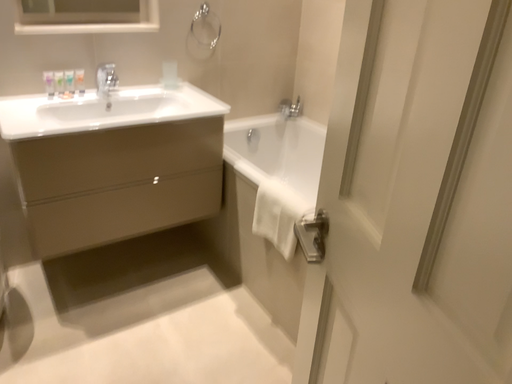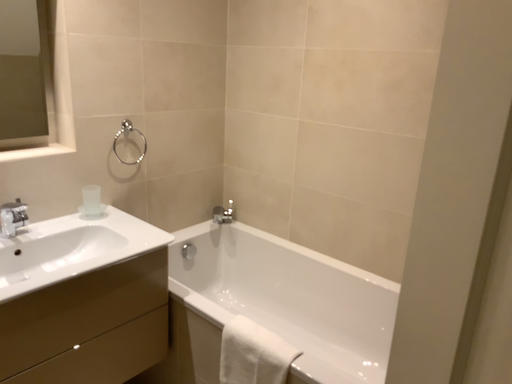
Question: Which way did the camera rotate in the video?

Choices:
 (A) rotated right
 (B) rotated left

Answer: (A)